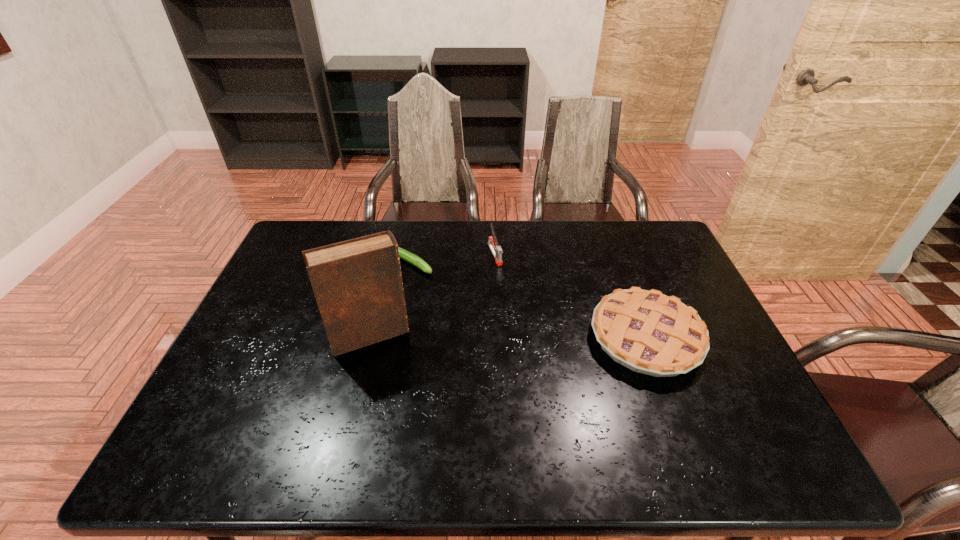
Locate an element on the screen. This screenshot has width=960, height=540. vacant region located 0.330m on the front-facing side of the shortest object is located at coordinates (512, 316).

Where is `free region located on the handle side of the third shortest object`? The width and height of the screenshot is (960, 540). free region located on the handle side of the third shortest object is located at coordinates (529, 329).

You are a GUI agent. You are given a task and a screenshot of the screen. Output one action in this format:
    pyautogui.click(x=<x>, y=<y>)
    Task: Click on the vacant space located on the handle side of the third shortest object
    The image size is (960, 540).
    Given the screenshot: What is the action you would take?
    pyautogui.click(x=521, y=314)

This screenshot has width=960, height=540. I want to click on vacant point located on the handle side of the third shortest object, so click(x=532, y=335).

This screenshot has height=540, width=960. What are the coordinates of `zucchini situated at the far edge` in the screenshot? It's located at (403, 254).

I want to click on stapler located in the far edge section of the desktop, so click(496, 250).

You are a GUI agent. You are given a task and a screenshot of the screen. Output one action in this format:
    pyautogui.click(x=<x>, y=<y>)
    Task: Click on the object located in the right edge section of the desktop
    The height and width of the screenshot is (540, 960).
    Given the screenshot: What is the action you would take?
    pyautogui.click(x=648, y=332)

Locate an element on the screen. vacant space at the far edge is located at coordinates (603, 258).

The image size is (960, 540). I want to click on vacant space at the near edge, so click(x=451, y=404).

In order to click on vacant space at the left edge of the desktop in this screenshot , I will do `click(287, 264)`.